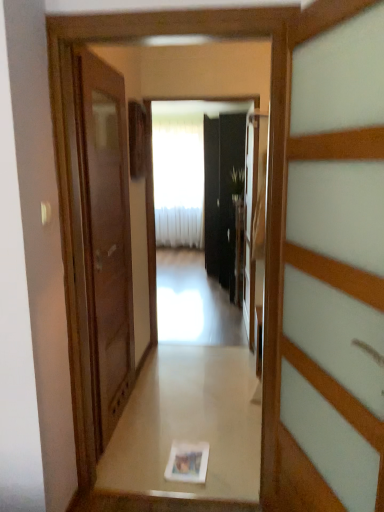
Question: Considering the relative sizes of glossy black mirror at center and black glass screen door at center in the image provided, is glossy black mirror at center thinner than black glass screen door at center?

Choices:
 (A) yes
 (B) no

Answer: (A)

Question: Is glossy black mirror at center facing away from black glass screen door at center?

Choices:
 (A) yes
 (B) no

Answer: (A)

Question: Can you confirm if glossy black mirror at center is positioned to the right of black glass screen door at center?

Choices:
 (A) yes
 (B) no

Answer: (B)

Question: Can you confirm if glossy black mirror at center is bigger than black glass screen door at center?

Choices:
 (A) yes
 (B) no

Answer: (B)

Question: Is glossy black mirror at center taller than black glass screen door at center?

Choices:
 (A) no
 (B) yes

Answer: (A)

Question: From a real-world perspective, is white glossy photo frame at center positioned above or below matte brown door at left, arranged as the 1th door when viewed from the back?

Choices:
 (A) below
 (B) above

Answer: (A)

Question: Is white glossy photo frame at center inside the boundaries of matte brown door at left, which is the 2th door in front-to-back order, or outside?

Choices:
 (A) outside
 (B) inside

Answer: (A)

Question: Looking at the image, does white glossy photo frame at center seem bigger or smaller compared to matte brown door at left, which ranks as the second door in right-to-left order?

Choices:
 (A) small
 (B) big

Answer: (A)

Question: Is white glossy photo frame at center in front of or behind matte brown door at left, which is the 2th door in front-to-back order, in the image?

Choices:
 (A) front
 (B) behind

Answer: (B)

Question: From a real-world perspective, is white glossy photo frame at center above or below wooden door at right, which ranks as the 2th door in back-to-front order?

Choices:
 (A) above
 (B) below

Answer: (B)

Question: In terms of height, does white glossy photo frame at center look taller or shorter compared to wooden door at right, which ranks as the 2th door in back-to-front order?

Choices:
 (A) tall
 (B) short

Answer: (B)

Question: Is white glossy photo frame at center situated inside wooden door at right, the 1th door viewed from the right, or outside?

Choices:
 (A) outside
 (B) inside

Answer: (A)

Question: Is white glossy photo frame at center wider or thinner than wooden door at right, which ranks as the 2th door in back-to-front order?

Choices:
 (A) wide
 (B) thin

Answer: (A)

Question: From a real-world perspective, relative to black glass screen door at center, is white sheer curtain at center vertically above or below?

Choices:
 (A) below
 (B) above

Answer: (B)

Question: From the image's perspective, is white sheer curtain at center located above or below black glass screen door at center?

Choices:
 (A) below
 (B) above

Answer: (B)